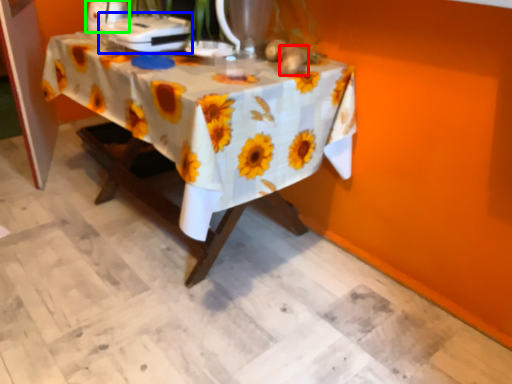
Question: Which object is the farthest from flower (highlighted by a red box)? Choose among these: appliance (highlighted by a blue box) or appliance (highlighted by a green box).

Choices:
 (A) appliance
 (B) appliance

Answer: (B)